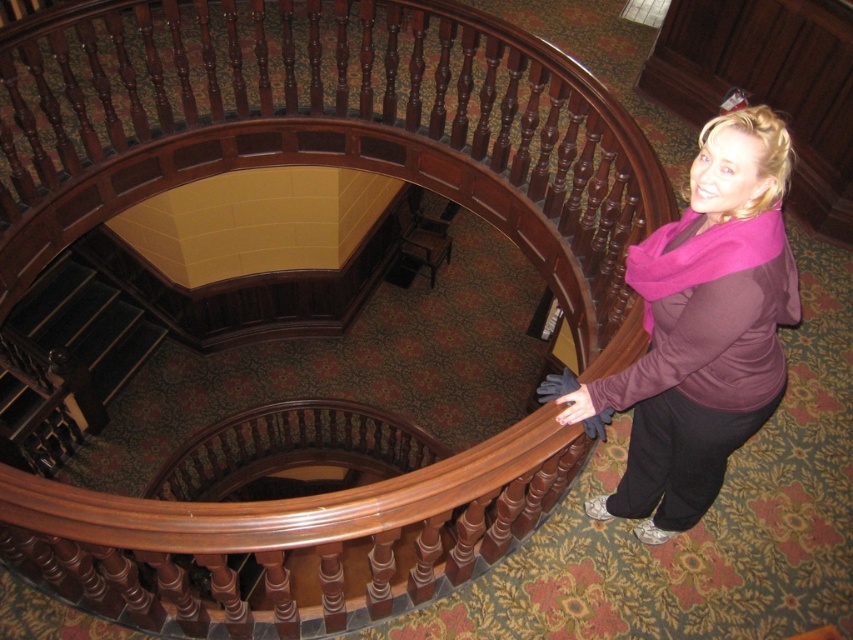
Is matte pink scarf at lower right closer to camera compared to dark wood stairs at lower left?

That is True.

Is matte pink scarf at lower right to the right of dark wood stairs at lower left from the viewer's perspective?

Yes, matte pink scarf at lower right is to the right of dark wood stairs at lower left.

Is point (752, 428) positioned behind point (123, 305)?

That is False.

In order to click on matte pink scarf at lower right in this screenshot , I will do `click(703, 328)`.